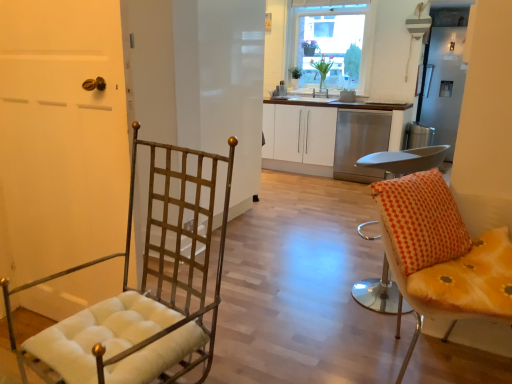
What are the coordinates of `free space between orange fabric cushioned stool at right, marked as the 2th chair in a left-to-right arrangement, and metallic grid screen door at center, the 2th screen door in the right-to-left sequence` in the screenshot? It's located at (290, 257).